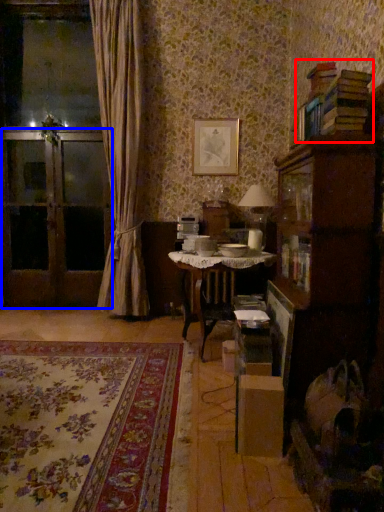
Question: Among these objects, which one is nearest to the camera, book (highlighted by a red box) or screen door (highlighted by a blue box)?

Choices:
 (A) book
 (B) screen door

Answer: (A)